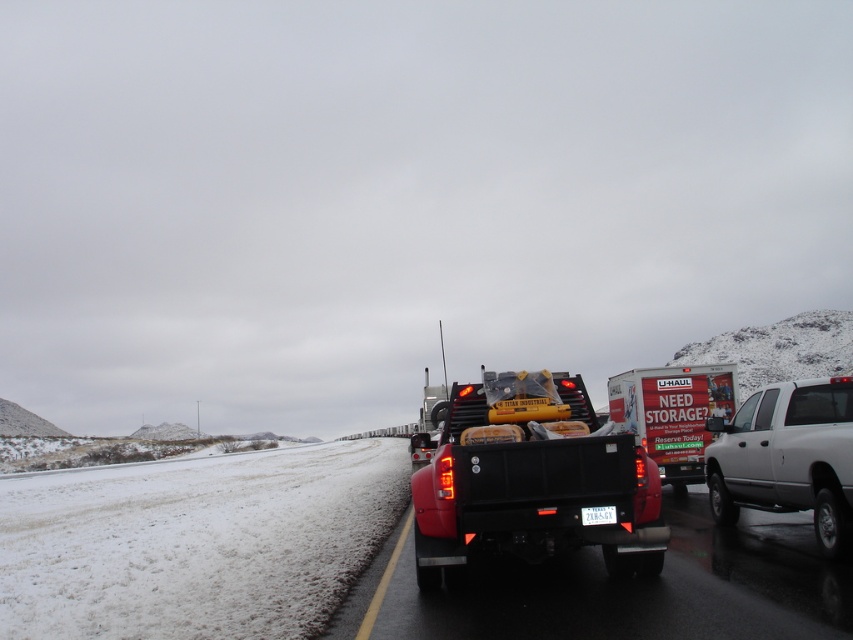
Question: Among these objects, which one is nearest to the camera?

Choices:
 (A) black matte truck at center
 (B) white matte pickup truck at right
 (C) white matte u-haul trailer at center
 (D) matte black tow truck at center

Answer: (D)

Question: Is the position of matte black tow truck at center less distant than that of white plastic license plate at center?

Choices:
 (A) no
 (B) yes

Answer: (A)

Question: Can you confirm if black matte truck at center is positioned below matte black tow truck at center?

Choices:
 (A) no
 (B) yes

Answer: (B)

Question: Which is farther from the white matte u-haul trailer at center?

Choices:
 (A) white matte pickup truck at right
 (B) white plastic license plate at center

Answer: (B)

Question: Based on their relative distances, which object is farther from the white matte u-haul trailer at center?

Choices:
 (A) white plastic license plate at center
 (B) matte black tow truck at center

Answer: (B)

Question: From the image, what is the correct spatial relationship of black matte truck at center in relation to matte black tow truck at center?

Choices:
 (A) above
 (B) below

Answer: (B)